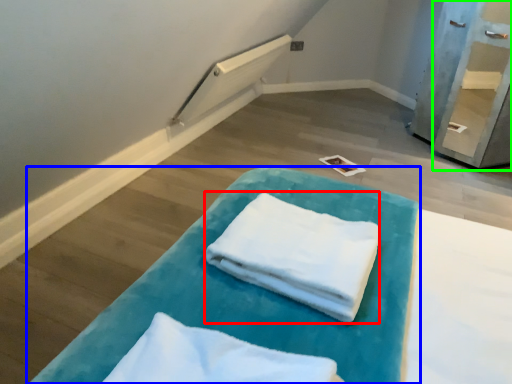
Question: Estimate the real-world distances between objects in this image. Which object is closer to cloth (highlighted by a red box), furniture (highlighted by a blue box) or shelf (highlighted by a green box)?

Choices:
 (A) furniture
 (B) shelf

Answer: (A)